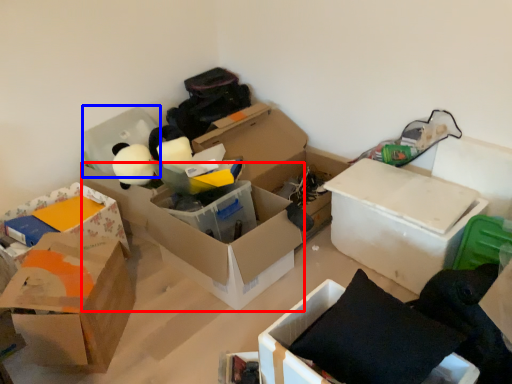
Question: Which of the following is the closest to the observer, box (highlighted by a red box) or storage box (highlighted by a blue box)?

Choices:
 (A) box
 (B) storage box

Answer: (A)